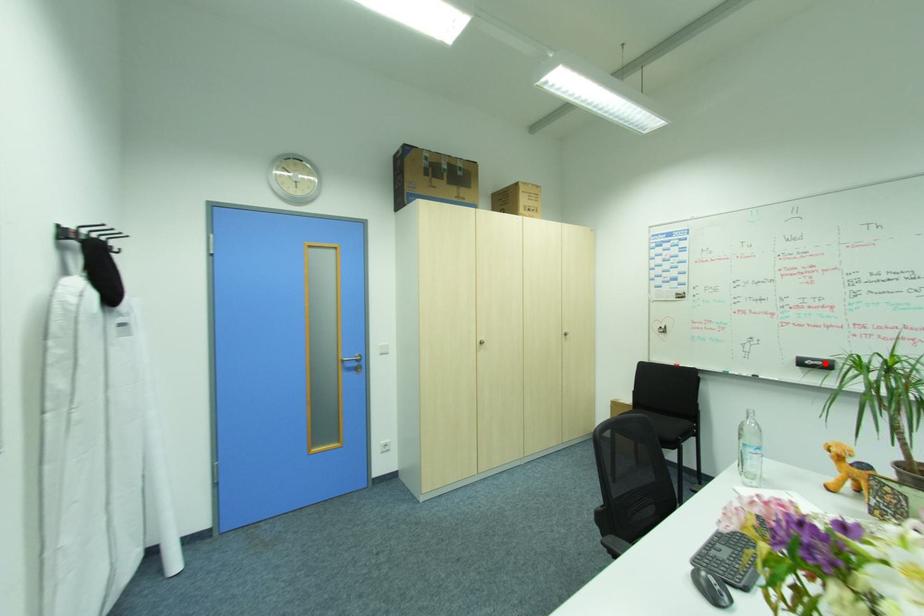
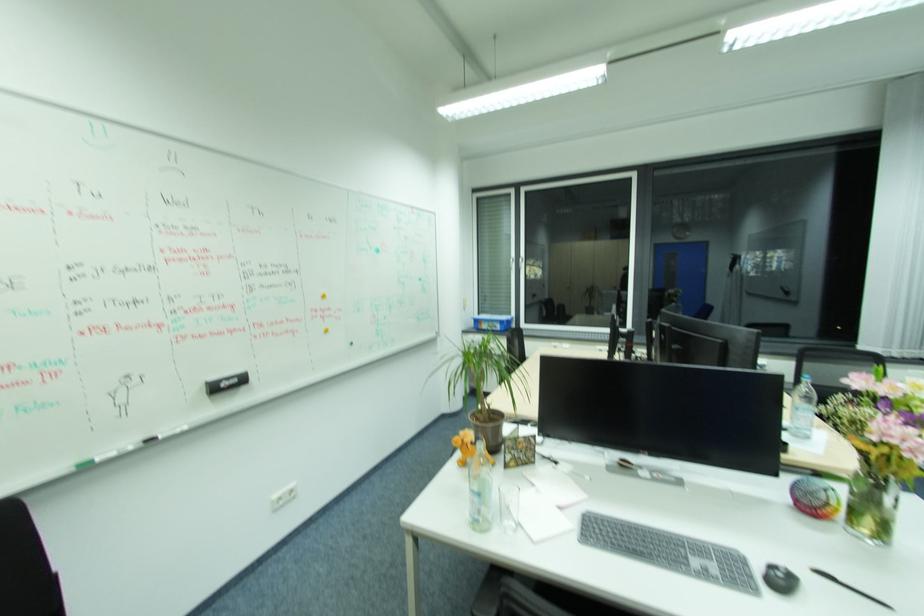
Where in the second image is the point corresponding to the highlighted location from the first image?

(240, 381)